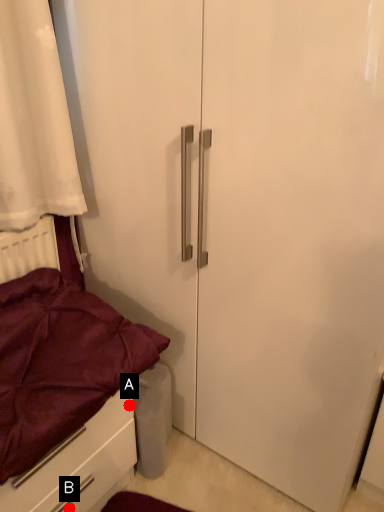
Question: Two points are circled on the image, labeled by A and B beside each circle. Among these points, which one is nearest to the camera?

Choices:
 (A) A is closer
 (B) B is closer

Answer: (B)